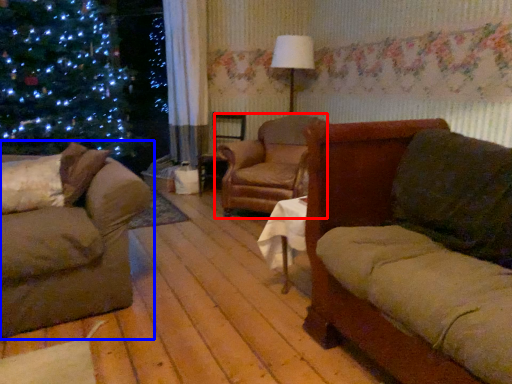
Question: Which object appears farthest to the camera in this image, chair (highlighted by a red box) or studio couch (highlighted by a blue box)?

Choices:
 (A) chair
 (B) studio couch

Answer: (A)